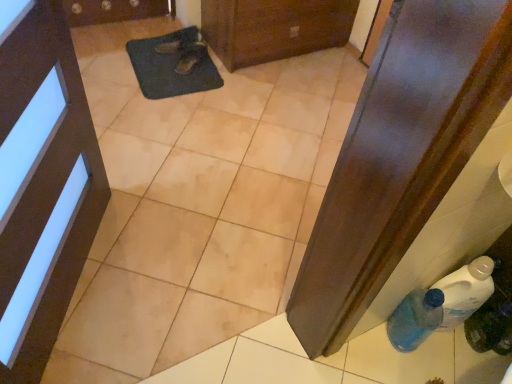
The width and height of the screenshot is (512, 384). I want to click on free area in between brown wooden door at upper center, which is counted as the 1th door, starting from the right, and matte black door at upper left, marked as the 2th door in a back-to-front arrangement, so click(218, 143).